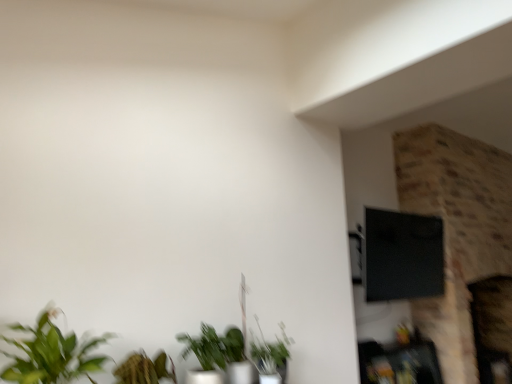
Question: Are wooden shelf at lower right and green matte plant at lower center, the third houseplant viewed from the front, located far from each other?

Choices:
 (A) yes
 (B) no

Answer: (A)

Question: Can you confirm if wooden shelf at lower right is shorter than green matte plant at lower center, the third houseplant viewed from the front?

Choices:
 (A) no
 (B) yes

Answer: (A)

Question: From the image's perspective, is wooden shelf at lower right above green matte plant at lower center, the third houseplant positioned from the left?

Choices:
 (A) no
 (B) yes

Answer: (A)

Question: Does wooden shelf at lower right touch green matte plant at lower center, the third houseplant viewed from the front?

Choices:
 (A) yes
 (B) no

Answer: (B)

Question: Is green matte plant at lower center, the 1th houseplant positioned from the back, inside wooden shelf at lower right?

Choices:
 (A) yes
 (B) no

Answer: (B)

Question: Would you say green leafy plant at lower left, the first houseplant viewed from the front, is to the left or to the right of green matte plant at lower center, the 2th houseplant viewed from the back, in the picture?

Choices:
 (A) left
 (B) right

Answer: (A)

Question: Would you say green leafy plant at lower left, which is the third houseplant in right-to-left order, is inside or outside green matte plant at lower center, positioned as the second houseplant in left-to-right order?

Choices:
 (A) inside
 (B) outside

Answer: (B)

Question: From the image's perspective, relative to green matte plant at lower center, the second houseplant in the front-to-back sequence, is green leafy plant at lower left, which appears as the 3th houseplant when viewed from the back, above or below?

Choices:
 (A) below
 (B) above

Answer: (B)

Question: From a real-world perspective, is green leafy plant at lower left, which is the 1th houseplant in left-to-right order, physically located above or below green matte plant at lower center, positioned as the second houseplant in left-to-right order?

Choices:
 (A) below
 (B) above

Answer: (B)

Question: Does point (367, 344) appear closer or farther from the camera than point (206, 352)?

Choices:
 (A) farther
 (B) closer

Answer: (A)

Question: From their relative heights in the image, would you say wooden shelf at lower right is taller or shorter than green matte plant at lower center, the second houseplant in the front-to-back sequence?

Choices:
 (A) tall
 (B) short

Answer: (A)

Question: Looking at the image, does wooden shelf at lower right seem bigger or smaller compared to green matte plant at lower center, the 2th houseplant viewed from the back?

Choices:
 (A) big
 (B) small

Answer: (A)

Question: From a real-world perspective, relative to green matte plant at lower center, the second houseplant in the front-to-back sequence, is wooden shelf at lower right vertically above or below?

Choices:
 (A) below
 (B) above

Answer: (A)

Question: From a real-world perspective, is green matte plant at lower center, which appears as the first houseplant when viewed from the right, above or below wooden shelf at lower right?

Choices:
 (A) above
 (B) below

Answer: (A)

Question: Choose the correct answer: Is green matte plant at lower center, which appears as the first houseplant when viewed from the right, inside wooden shelf at lower right or outside it?

Choices:
 (A) outside
 (B) inside

Answer: (A)